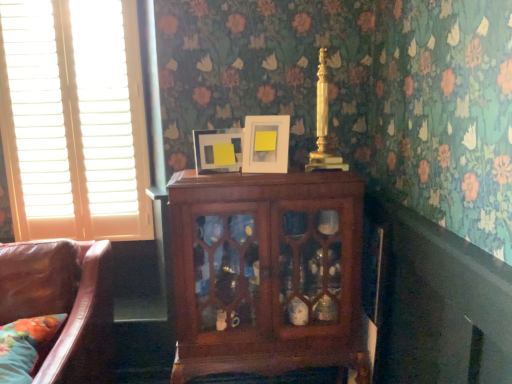
Question: Would you consider matte white picture frame at upper center, which is counted as the 1th picture frame, starting from the right, to be distant from mahogany cabinet at center?

Choices:
 (A) yes
 (B) no

Answer: (B)

Question: Considering the relative sizes of matte white picture frame at upper center, which is counted as the 1th picture frame, starting from the right, and mahogany cabinet at center in the image provided, is matte white picture frame at upper center, which is counted as the 1th picture frame, starting from the right, thinner than mahogany cabinet at center?

Choices:
 (A) no
 (B) yes

Answer: (B)

Question: From a real-world perspective, is matte white picture frame at upper center, the 2th picture frame viewed from the left, located higher than mahogany cabinet at center?

Choices:
 (A) yes
 (B) no

Answer: (A)

Question: Does matte white picture frame at upper center, which is counted as the 1th picture frame, starting from the right, have a smaller size compared to mahogany cabinet at center?

Choices:
 (A) no
 (B) yes

Answer: (B)

Question: Does matte white picture frame at upper center, which is counted as the 1th picture frame, starting from the right, have a larger size compared to mahogany cabinet at center?

Choices:
 (A) no
 (B) yes

Answer: (A)

Question: From the image's perspective, is white wood blinds at left positioned above or below mahogany cabinet at center?

Choices:
 (A) above
 (B) below

Answer: (A)

Question: In terms of width, does white wood blinds at left look wider or thinner when compared to mahogany cabinet at center?

Choices:
 (A) thin
 (B) wide

Answer: (A)

Question: Does point (49, 200) appear closer or farther from the camera than point (271, 314)?

Choices:
 (A) closer
 (B) farther

Answer: (B)

Question: From a real-world perspective, is white wood blinds at left above or below mahogany cabinet at center?

Choices:
 (A) below
 (B) above

Answer: (B)

Question: Considering the positions of point (227, 157) and point (268, 124), is point (227, 157) closer or farther from the camera than point (268, 124)?

Choices:
 (A) farther
 (B) closer

Answer: (A)

Question: From a real-world perspective, is matte white picture frame at center, arranged as the 2th picture frame when viewed from the right, positioned above or below matte white picture frame at upper center, which is counted as the 1th picture frame, starting from the right?

Choices:
 (A) above
 (B) below

Answer: (B)

Question: Is matte white picture frame at center, arranged as the 2th picture frame when viewed from the right, taller or shorter than matte white picture frame at upper center, the 2th picture frame viewed from the left?

Choices:
 (A) short
 (B) tall

Answer: (A)

Question: Is matte white picture frame at center, arranged as the 2th picture frame when viewed from the right, situated inside matte white picture frame at upper center, the 2th picture frame viewed from the left, or outside?

Choices:
 (A) inside
 (B) outside

Answer: (B)

Question: Is floral fabric pillow at lower left bigger or smaller than white wood blinds at left?

Choices:
 (A) small
 (B) big

Answer: (A)

Question: Is point (28, 319) positioned closer to the camera than point (82, 130)?

Choices:
 (A) closer
 (B) farther

Answer: (A)